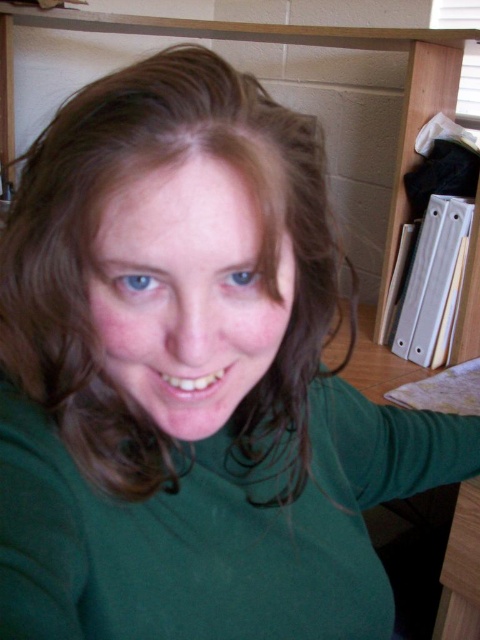
You are an optometrist examining a patient. You notice two eyes in the image labeled as the blue matte eye at center and the blue iridescent eye at center. Which eye has a larger vertical dimension?

The blue matte eye at center has a greater height compared to the blue iridescent eye at center, so the blue matte eye at center has a larger vertical dimension.

You are a photographer adjusting the lighting to ensure both eyes are equally visible. Which eye, the blue matte eye at center or the blue iridescent eye at center, might need more light to be seen clearly?

The blue matte eye at center is below the blue iridescent eye at center. Since matte surfaces typically require more direct light to appear bright, the blue matte eye at center likely needs more light to be seen clearly.